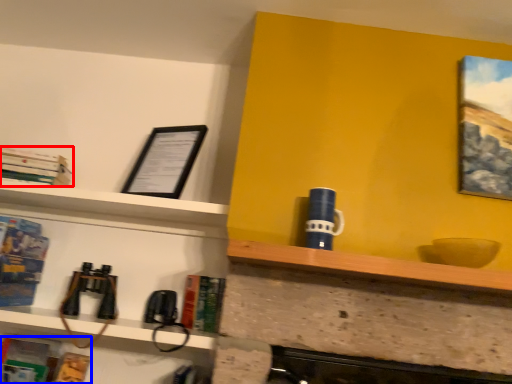
Question: Among these objects, which one is nearest to the camera, book (highlighted by a red box) or book (highlighted by a blue box)?

Choices:
 (A) book
 (B) book

Answer: (B)